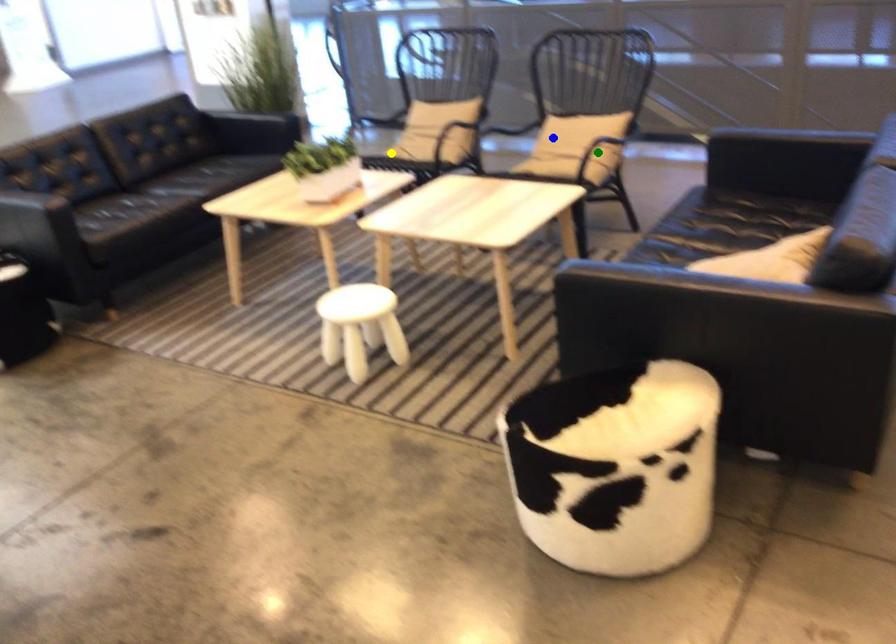
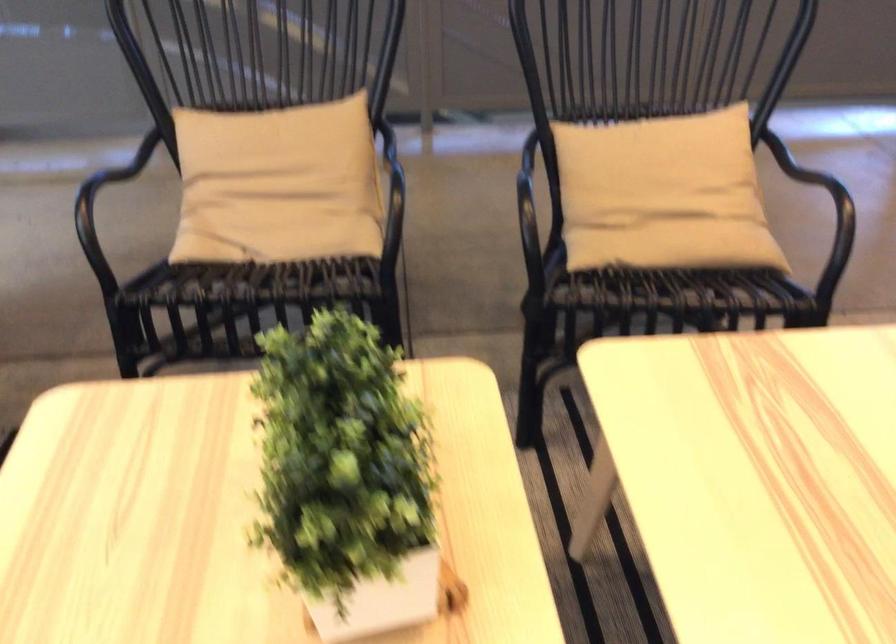
I am providing you with two images of the same scene from different viewpoints. Three points are marked in image1. Which point corresponds to a part or object that is occluded in image2?In image1, three points are marked. Which of them correspond to a part or object that is occluded in image2?Among the three points shown in image1, which one corresponds to a part or object that is no longer visible due to occlusion in image2?

green point